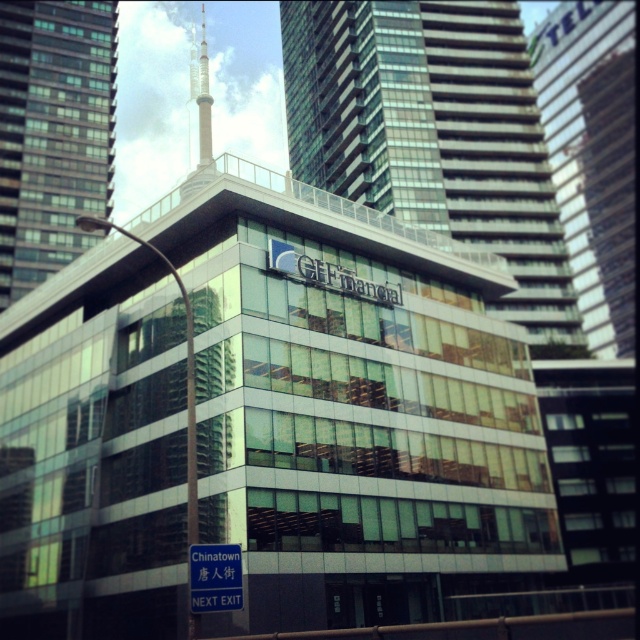
You are a tourist holding a map and looking at the glassy skyscraper at center and the blue plastic street sign at lower center. Which object appears larger in the scene?

The glassy skyscraper at center appears larger than the blue plastic street sign at lower center.